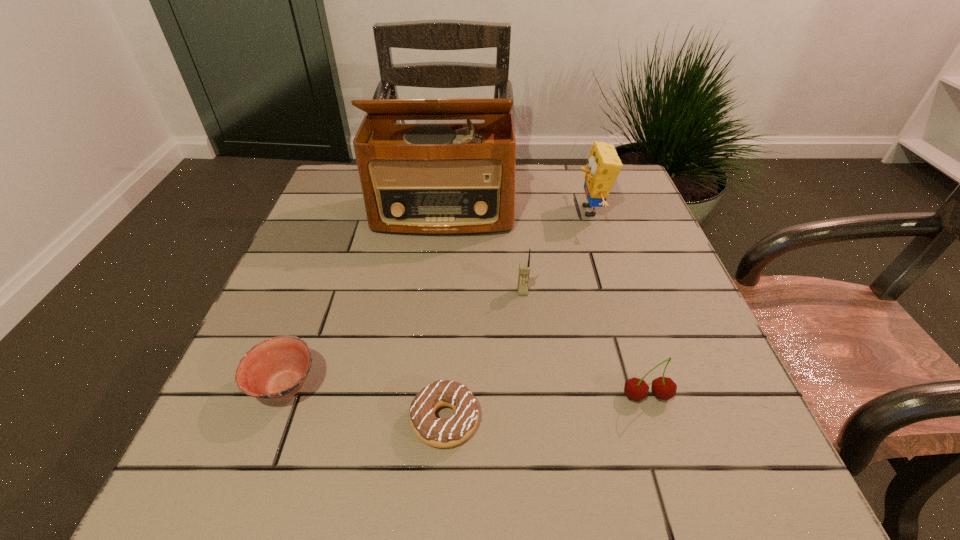
Locate an element on the screen. empty space between the radio receiver and the doughnut is located at coordinates point(444,318).

At what (x,y) coordinates should I click in order to perform the action: click on free space between the cherry and the radio receiver. Please return your answer as a coordinate pair (x, y). Looking at the image, I should click on [545, 306].

Identify the location of vacant area that lies between the cherry and the radio receiver. The width and height of the screenshot is (960, 540). (545, 306).

You are a GUI agent. You are given a task and a screenshot of the screen. Output one action in this format:
    pyautogui.click(x=<x>, y=<y>)
    Task: Click on the empty space between the shortest object and the cherry
    
    Given the screenshot: What is the action you would take?
    pyautogui.click(x=546, y=408)

Find the location of a particular element. This screenshot has width=960, height=540. vacant space in between the sponge and the second shortest object is located at coordinates (438, 299).

Find the location of `empty location between the tallest object and the doughnut`. empty location between the tallest object and the doughnut is located at coordinates (444, 318).

Locate an element on the screen. vacant space in between the sponge and the leftmost object is located at coordinates (438, 299).

Identify which object is the second nearest to the doughnut. Please provide its 2D coordinates. Your answer should be formatted as a tuple, i.e. [(x, y)], where the tuple contains the x and y coordinates of a point satisfying the conditions above.

[(524, 268)]

Where is `object that ranks as the fourth closest to the shortest object`? This screenshot has width=960, height=540. object that ranks as the fourth closest to the shortest object is located at coordinates (439, 179).

At what (x,y) coordinates should I click in order to perform the action: click on free region that satisfies the following two spatial constraints: 1. on the face of the fifth shortest object; 2. on the surface of the cherry. Please return your answer as a coordinate pair (x, y). Looking at the image, I should click on (649, 396).